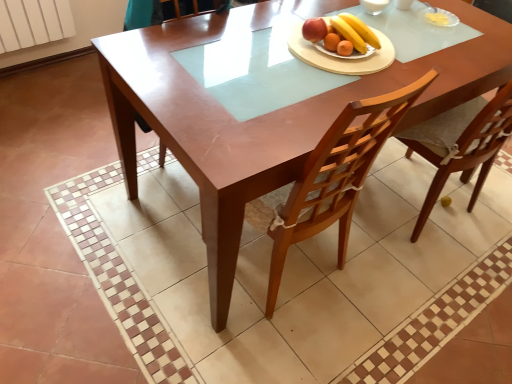
The height and width of the screenshot is (384, 512). What do you see at coordinates (265, 114) in the screenshot?
I see `wooden table at center` at bounding box center [265, 114].

Find the location of a particular element. wooden table at center is located at coordinates (265, 114).

Image resolution: width=512 pixels, height=384 pixels. What do you see at coordinates (341, 33) in the screenshot? I see `shiny white plate with fruits at center` at bounding box center [341, 33].

Image resolution: width=512 pixels, height=384 pixels. I want to click on shiny white plate with fruits at center, so click(341, 33).

Locate an element on the screen. This screenshot has height=384, width=512. wooden table at center is located at coordinates (265, 114).

Which is more to the left, shiny white plate with fruits at center or wooden table at center?

wooden table at center is more to the left.

Between shiny white plate with fruits at center and wooden table at center, which one is positioned in front?

Positioned in front is wooden table at center.

Which point is more forward, [312,29] or [126,94]?

The point [312,29] is closer to the camera.

From the image's perspective, does shiny white plate with fruits at center appear lower than wooden table at center?

Incorrect, from the image's perspective, shiny white plate with fruits at center is higher than wooden table at center.

Based on the photo, from a real-world perspective, is shiny white plate with fruits at center physically located above or below wooden table at center?

Clearly, from a real-world perspective, shiny white plate with fruits at center is above wooden table at center.

In terms of width, does shiny white plate with fruits at center look wider or thinner when compared to wooden table at center?

Considering their sizes, shiny white plate with fruits at center looks slimmer than wooden table at center.

Considering the relative sizes of shiny white plate with fruits at center and wooden table at center in the image provided, is shiny white plate with fruits at center shorter than wooden table at center?

Correct, shiny white plate with fruits at center is not as tall as wooden table at center.

Who is bigger, shiny white plate with fruits at center or wooden table at center?

Bigger between the two is wooden table at center.

Based on the photo, is shiny white plate with fruits at center outside of wooden table at center?

Actually, shiny white plate with fruits at center is within wooden table at center.

Is shiny white plate with fruits at center positioned far away from wooden table at center?

Actually, shiny white plate with fruits at center and wooden table at center are a little close together.

Does shiny white plate with fruits at center turn towards wooden table at center?

No, shiny white plate with fruits at center does not turn towards wooden table at center.

In the image, there is a wooden table at center. Where is `fruit salad above it (from the image's perspective)`? Image resolution: width=512 pixels, height=384 pixels. fruit salad above it (from the image's perspective) is located at coordinates (341, 33).

Which is more to the left, wooden table at center or shiny white plate with fruits at center?

From the viewer's perspective, wooden table at center appears more on the left side.

Is wooden table at center behind shiny white plate with fruits at center?

No, the depth of wooden table at center is less than that of shiny white plate with fruits at center.

Is point (138, 57) positioned after point (342, 41)?

No, (138, 57) is in front of (342, 41).

From the image's perspective, which is above, wooden table at center or shiny white plate with fruits at center?

shiny white plate with fruits at center, from the image's perspective.

From a real-world perspective, is wooden table at center located higher than shiny white plate with fruits at center?

No, from a real-world perspective, wooden table at center is not above shiny white plate with fruits at center.

Is wooden table at center wider than shiny white plate with fruits at center?

Correct, the width of wooden table at center exceeds that of shiny white plate with fruits at center.

Between wooden table at center and shiny white plate with fruits at center, which one has more height?

Standing taller between the two is wooden table at center.

Is wooden table at center bigger than shiny white plate with fruits at center?

Yes, wooden table at center is bigger than shiny white plate with fruits at center.

Can we say wooden table at center lies outside shiny white plate with fruits at center?

Yes, wooden table at center is outside of shiny white plate with fruits at center.

Is wooden table at center not near shiny white plate with fruits at center?

Actually, wooden table at center and shiny white plate with fruits at center are a little close together.

Is wooden table at center oriented towards shiny white plate with fruits at center?

No, wooden table at center does not turn towards shiny white plate with fruits at center.

How distant is wooden table at center from shiny white plate with fruits at center?

They are 16.36 inches apart.

Locate an element on the screen. This screenshot has height=384, width=512. table located underneath the shiny white plate with fruits at center (from a real-world perspective) is located at coordinates (265, 114).

Locate an element on the screen. Image resolution: width=512 pixels, height=384 pixels. fruit salad above the wooden table at center (from a real-world perspective) is located at coordinates (341, 33).

At what (x,y) coordinates should I click in order to perform the action: click on table in front of the shiny white plate with fruits at center. Please return your answer as a coordinate pair (x, y). Looking at the image, I should click on (265, 114).